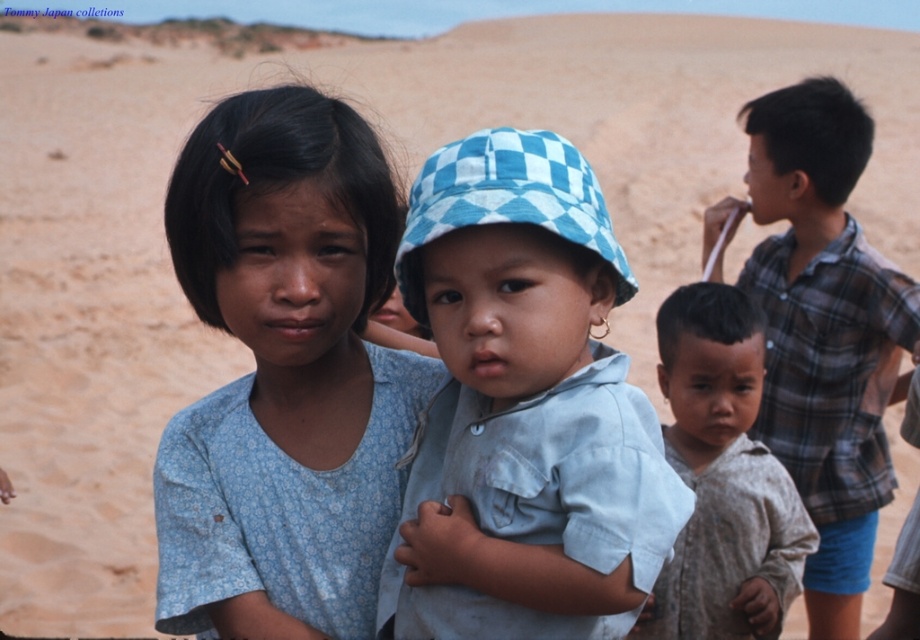
You are a photographer setting up a shot of the scene. You need to ensure that the blue floral shirt at center and the plaid cotton shirt at right are both visible in the frame. Based on their widths, which shirt should you focus on to ensure both are fully captured?

The blue floral shirt at center is wider than the plaid cotton shirt at right, so focusing on the blue floral shirt at center would ensure both are fully visible in the frame since it requires more space.

Consider the image. You are a photographer trying to capture a group photo of the children. The blue floral shirt at center and the brown cotton shirt at lower right are in your frame. Which of the two shirts should you focus on if you want to highlight a larger object in the photo?

The blue floral shirt at center is larger in size than the brown cotton shirt at lower right, so focusing on the blue floral shirt at center would highlight the larger object.